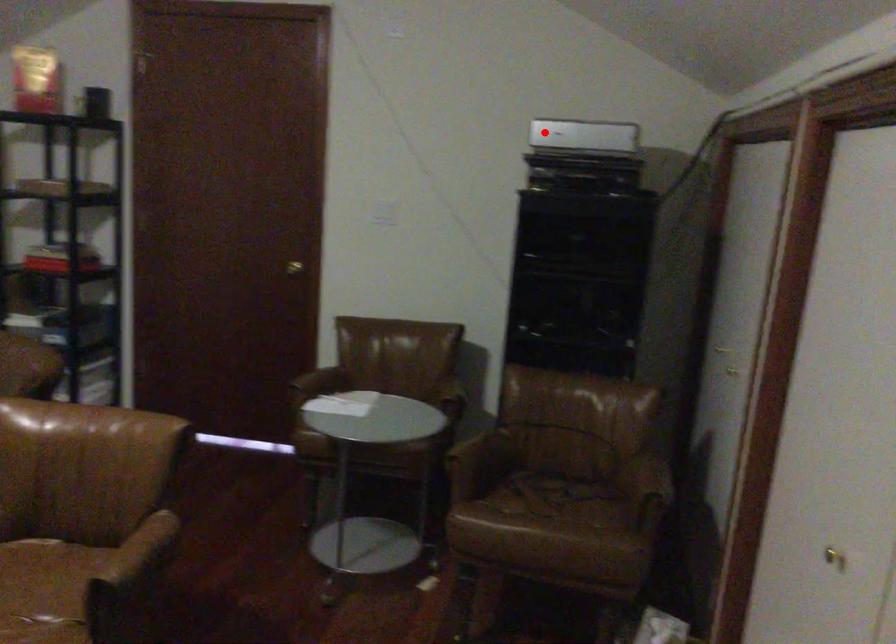
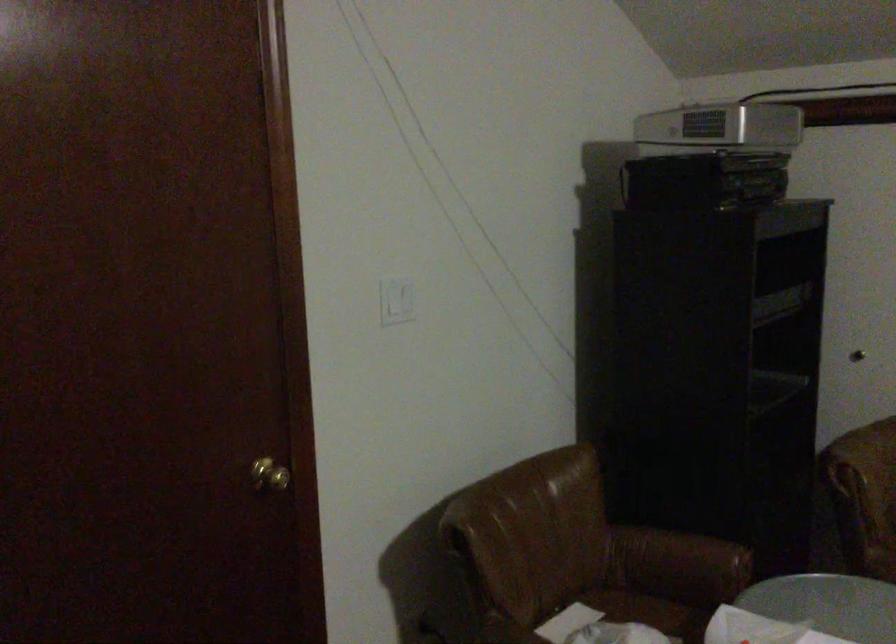
The point at the highlighted location is marked in the first image. Where is the corresponding point in the second image?

(719, 129)